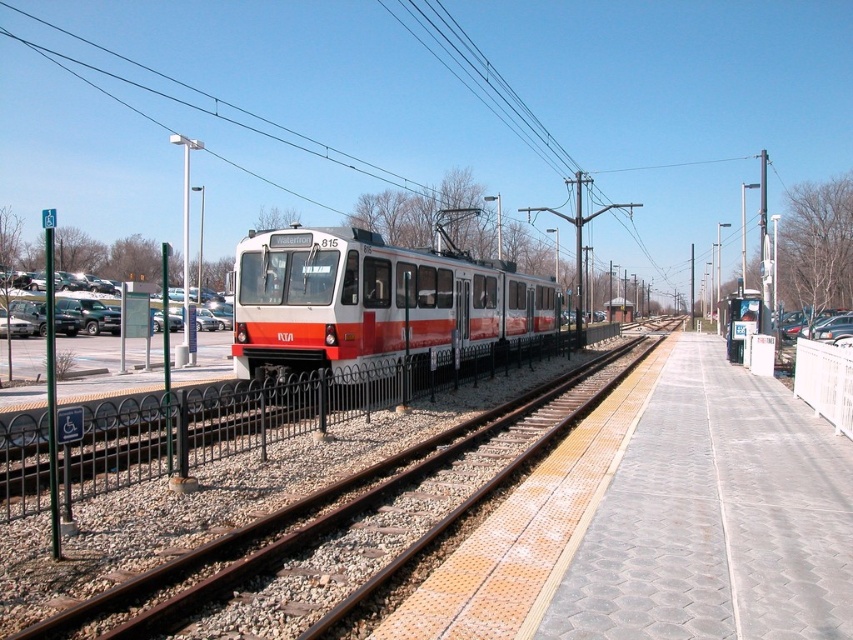
Question: Is the position of metal train track at center more distant than that of white glossy train at center?

Choices:
 (A) yes
 (B) no

Answer: (B)

Question: Can you confirm if metal train track at center is positioned below white glossy train at center?

Choices:
 (A) no
 (B) yes

Answer: (B)

Question: From the image, what is the correct spatial relationship of metal train track at center in relation to metallic wire at upper center?

Choices:
 (A) above
 (B) below

Answer: (B)

Question: Among these objects, which one is farthest from the camera?

Choices:
 (A) white glossy train at center
 (B) metallic wire at upper center
 (C) metal train track at center

Answer: (B)

Question: Estimate the real-world distances between objects in this image. Which object is farther from the metal train track at center?

Choices:
 (A) metallic wire at upper center
 (B) white glossy train at center

Answer: (A)

Question: Which object is closer to the camera taking this photo?

Choices:
 (A) metal train track at center
 (B) metallic wire at upper center

Answer: (A)